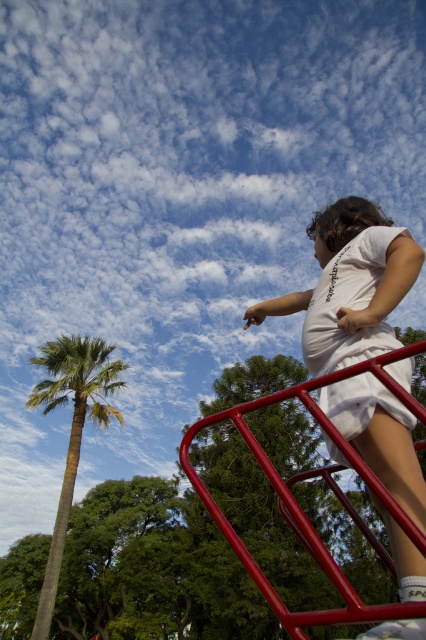
You are a photographer standing at the base of the playground structure. You want to take a photo of the child but need to ensure you can see the white cotton shirt at upper right clearly. Based on your height of 1.7 meters, will the shirt be visible above the playground structure?

The white cotton shirt at upper right is 1.18 meters away from the viewer. Since the photographer is 1.7 meters tall, the shirt will be visible above the playground structure as the distance is less than the photographer height.

You are a photographer trying to capture the child in the scene. You notice two white cotton items at the upper right corner of your viewfinder. Which one is more to the right? The options are the white cotton shirt at upper right and the white cotton dress at upper right.

The white cotton shirt at upper right is positioned on the right side of the white cotton dress at upper right, so the white cotton shirt at upper right is more to the right.